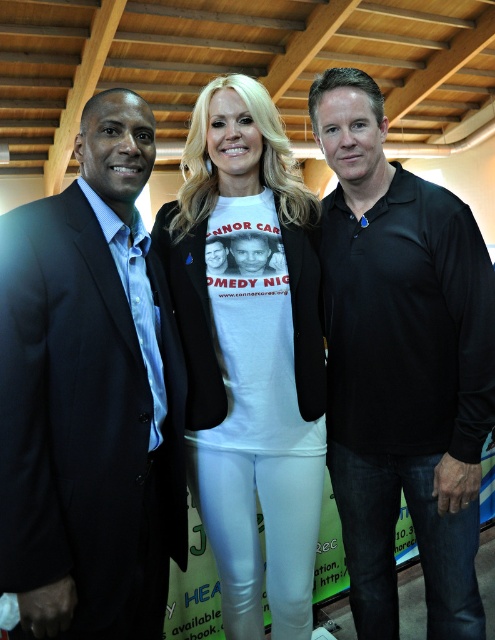
Is matte black suit at left below white matte t-shirt at center?

No.

Can you confirm if matte black suit at left is wider than white matte t-shirt at center?

Incorrect, matte black suit at left's width does not surpass white matte t-shirt at center's.

Does point (82, 244) lie behind point (203, 410)?

No, (82, 244) is closer to viewer.

You are a GUI agent. You are given a task and a screenshot of the screen. Output one action in this format:
    pyautogui.click(x=<x>, y=<y>)
    Task: Click on the matte black suit at left
    This screenshot has height=640, width=495.
    Given the screenshot: What is the action you would take?
    pyautogui.click(x=90, y=396)

Is black smooth polo shirt at right positioned at the back of white matte t-shirt at center?

No, black smooth polo shirt at right is closer to the viewer.

Is point (425, 298) farther from camera compared to point (245, 506)?

That is False.

You are a GUI agent. You are given a task and a screenshot of the screen. Output one action in this format:
    pyautogui.click(x=<x>, y=<y>)
    Task: Click on the black smooth polo shirt at right
    
    Given the screenshot: What is the action you would take?
    pyautogui.click(x=401, y=364)

Can you confirm if matte black suit at left is positioned to the right of black smooth polo shirt at right?

Incorrect, matte black suit at left is not on the right side of black smooth polo shirt at right.

From the picture: Is matte black suit at left thinner than black smooth polo shirt at right?

Indeed, matte black suit at left has a lesser width compared to black smooth polo shirt at right.

Who is more forward, (82, 420) or (437, 202)?

Positioned in front is point (82, 420).

Find the location of `matte black suit at left`. matte black suit at left is located at coordinates (90, 396).